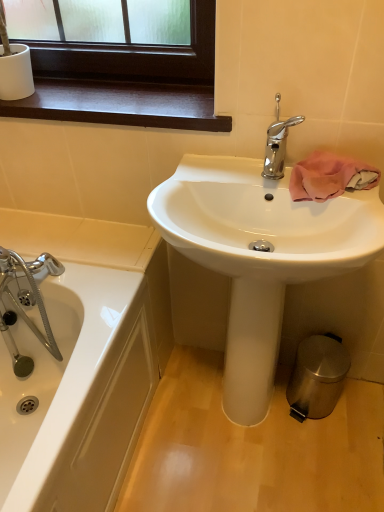
Locate an element on the screen. The image size is (384, 512). empty space that is ontop of dark wood window sill at upper left (from a real-world perspective) is located at coordinates (111, 97).